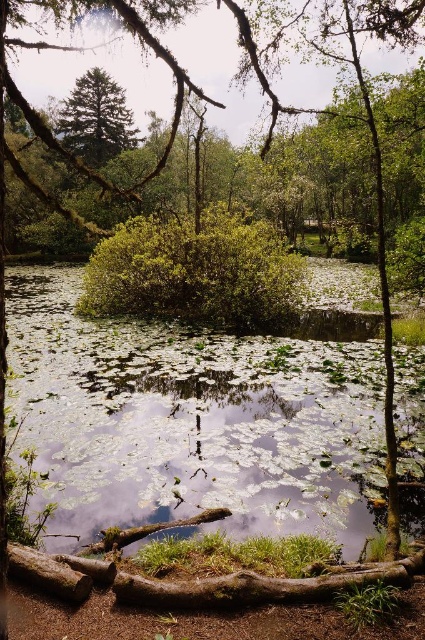
Does green leafy water at center have a lesser width compared to green matte tree at upper left?

No.

Consider the image. Who is shorter, green leafy water at center or green matte tree at upper left?

green leafy water at center is shorter.

What are the coordinates of `green leafy water at center` in the screenshot? It's located at pyautogui.click(x=189, y=419).